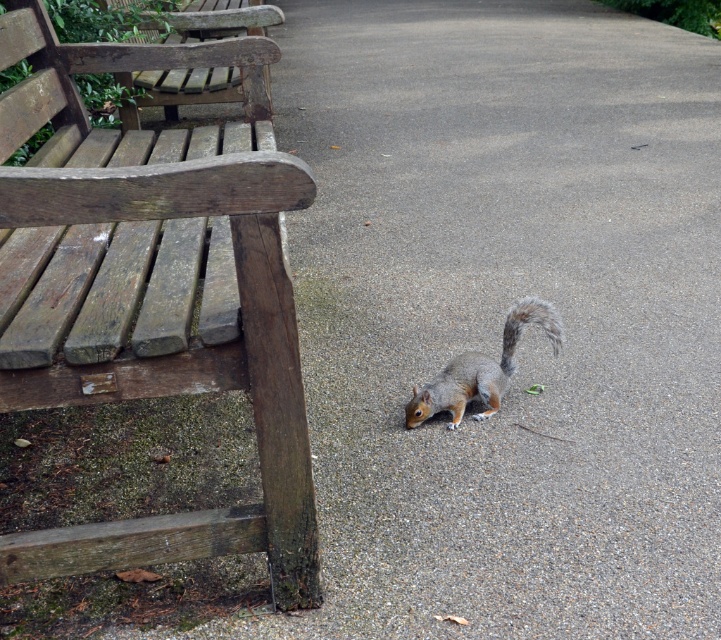
You are standing at the center of the image. Which direction should you move to reach the weathered wood bench at upper left?

You should move toward the upper left direction to reach the weathered wood bench at upper left.

Consider the image. You are a painter standing at the center of the scene. You want to paint the tallest object between the weathered wood bench at left and the weathered wood bench at upper left. Which one should you focus on?

The weathered wood bench at left is much taller than the weathered wood bench at upper left, so you should focus on painting the weathered wood bench at left.

You are a park visitor trying to sit on one of the benches. You see the weathered wood bench at left and the weathered wood bench at upper left. Which bench has a larger seating area?

The weathered wood bench at left has a larger seating area because its width surpasses that of the weathered wood bench at upper left.